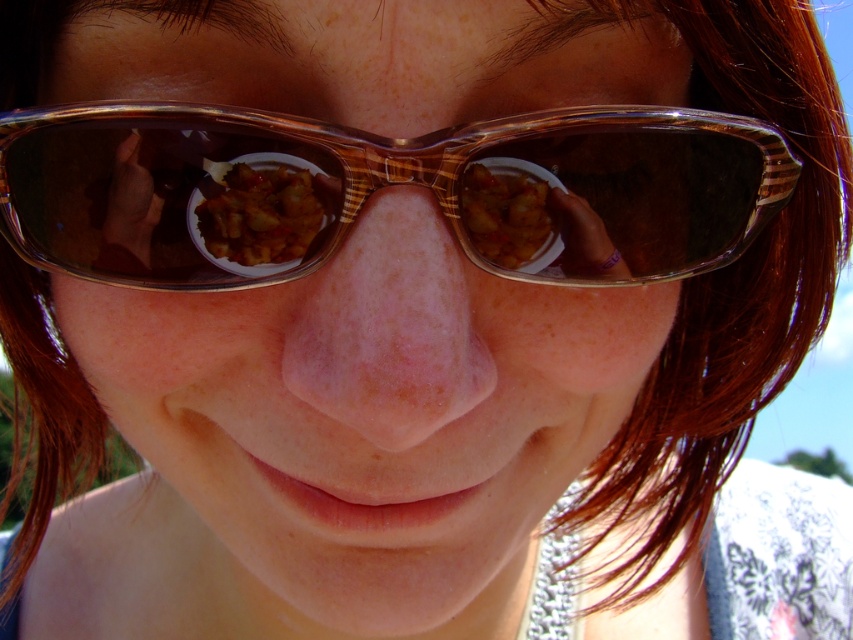
Question: Which point is farther to the camera?

Choices:
 (A) (292, 214)
 (B) (556, 253)
 (C) (254, 212)

Answer: (B)

Question: Is translucent brown goggles at center to the left of golden fried chicken at nose from the viewer's perspective?

Choices:
 (A) yes
 (B) no

Answer: (A)

Question: Which point appears closest to the camera in this image?

Choices:
 (A) pos(692,125)
 (B) pos(467,209)

Answer: (B)

Question: Among these objects, which one is farthest from the camera?

Choices:
 (A) matte brown bowl at center
 (B) translucent brown goggles at center

Answer: (A)

Question: Can you confirm if matte brown bowl at center is bigger than golden fried chicken at nose?

Choices:
 (A) no
 (B) yes

Answer: (B)

Question: Is matte brown bowl at center smaller than golden fried chicken at nose?

Choices:
 (A) yes
 (B) no

Answer: (B)